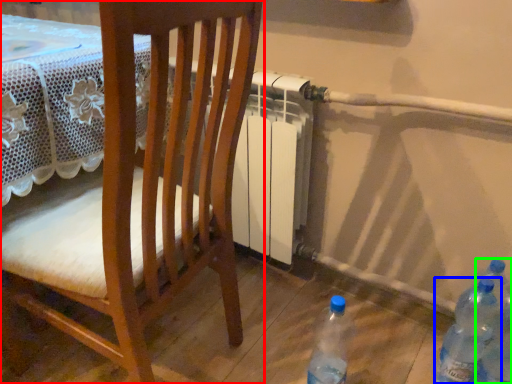
Question: Which object is positioned closest to chair (highlighted by a red box)? Select from bottle (highlighted by a blue box) and bottle (highlighted by a green box).

Choices:
 (A) bottle
 (B) bottle

Answer: (A)